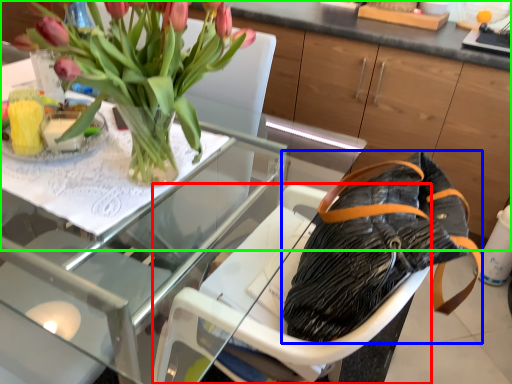
Question: Based on their relative distances, which object is farther from armchair (highlighted by a red box)? Choose from handbag (highlighted by a blue box) and dresser (highlighted by a green box).

Choices:
 (A) handbag
 (B) dresser

Answer: (B)